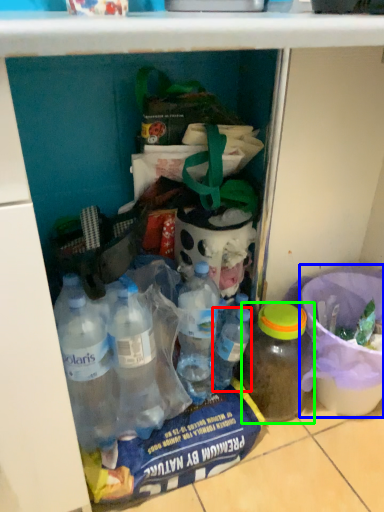
Question: Which object is the closest to the bottle (highlighted by a red box)? Choose among these: bucket (highlighted by a blue box) or bottle (highlighted by a green box).

Choices:
 (A) bucket
 (B) bottle

Answer: (B)